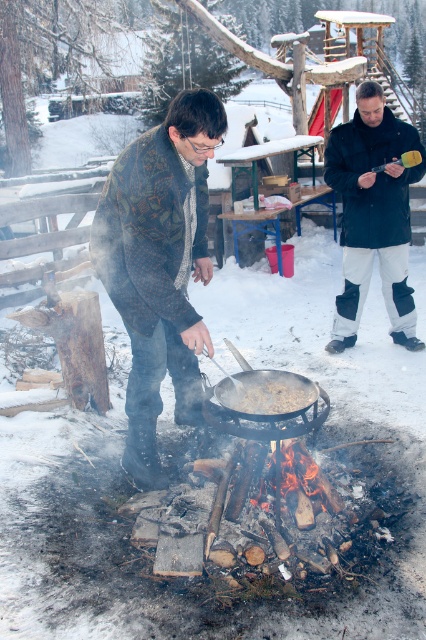
Question: Is dark blue jacket at center smaller than wooden picnic table at center?

Choices:
 (A) yes
 (B) no

Answer: (A)

Question: Which of the following is the farthest from the observer?

Choices:
 (A) knitted sweater at center
 (B) brown matte pan at center

Answer: (B)

Question: Can you confirm if dark blue jacket at center is bigger than wooden picnic table at center?

Choices:
 (A) yes
 (B) no

Answer: (B)

Question: Which point appears farthest from the camera in this image?

Choices:
 (A) (287, 378)
 (B) (400, 125)

Answer: (B)

Question: Where is wooden picnic table at center located in relation to brown matte pan at center in the image?

Choices:
 (A) left
 (B) right

Answer: (B)

Question: Which of these objects is positioned farthest from the wooden picnic table at center?

Choices:
 (A) brown matte pan at center
 (B) knitted sweater at center
 (C) dark blue jacket at center

Answer: (A)